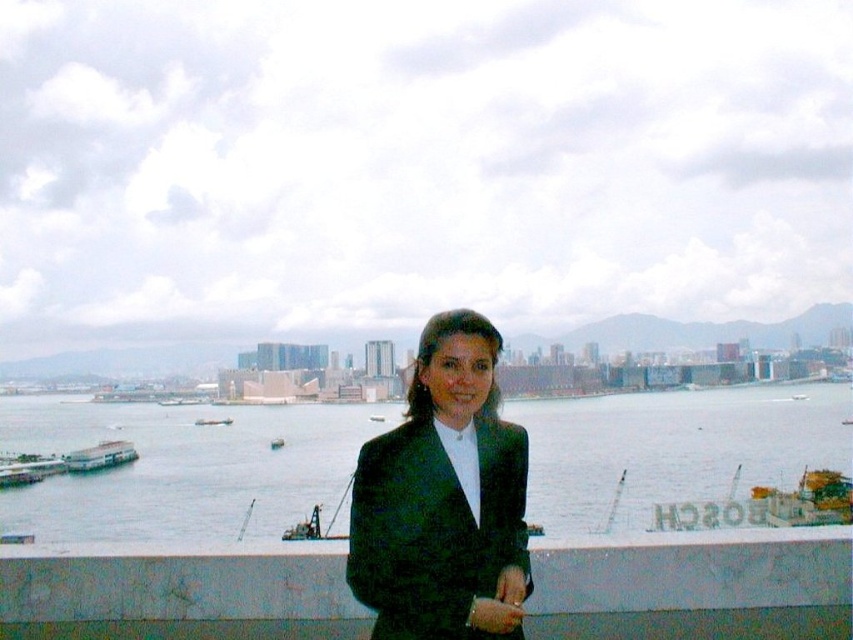
You are a photographer trying to capture the city skyline in the background. You notice the black matte suit at center might be blocking your view. Can you move the subject to the left by 0.2 meters to ensure the skyline is fully visible?

Since the black matte suit at center is located at point (444, 499), moving it 0.2 meters to the left would adjust its position. However, without knowing the exact dimensions of the scene or the distance between the subject and the skyline, it is difficult to determine if this adjustment would fully reveal the skyline. Consider experimenting with different positions to achieve the desired composition.

You are a photographer capturing the scene of a person dressed in a black matte suit at center and a metallic gray ship at center. Which object is closer to the photographer?

The black matte suit at center is closer to the photographer because it is positioned over the metallic gray ship at center.